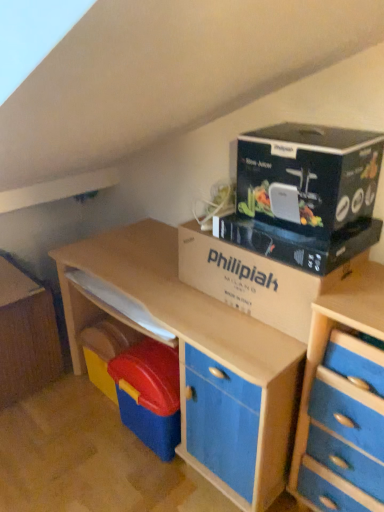
Question: Is black cardboard at upper right looking in the opposite direction of blue matte file cabinet at lower left?

Choices:
 (A) no
 (B) yes

Answer: (A)

Question: Is black cardboard at upper right surrounding blue matte file cabinet at lower left?

Choices:
 (A) no
 (B) yes

Answer: (A)

Question: Is black cardboard at upper right to the right of blue matte file cabinet at lower left from the viewer's perspective?

Choices:
 (A) no
 (B) yes

Answer: (B)

Question: Does black cardboard at upper right have a smaller size compared to blue matte file cabinet at lower left?

Choices:
 (A) yes
 (B) no

Answer: (A)

Question: From a real-world perspective, does black cardboard at upper right sit lower than blue matte file cabinet at lower left?

Choices:
 (A) yes
 (B) no

Answer: (B)

Question: Does point (359, 508) appear closer or farther from the camera than point (29, 332)?

Choices:
 (A) closer
 (B) farther

Answer: (A)

Question: From their relative heights in the image, would you say blue wood chest of drawers at right is taller or shorter than blue matte file cabinet at lower left?

Choices:
 (A) short
 (B) tall

Answer: (B)

Question: From the image's perspective, is blue wood chest of drawers at right above or below blue matte file cabinet at lower left?

Choices:
 (A) below
 (B) above

Answer: (A)

Question: Do you think blue wood chest of drawers at right is within blue matte file cabinet at lower left, or outside of it?

Choices:
 (A) inside
 (B) outside

Answer: (B)

Question: From the image's perspective, is blue matte file cabinet at lower left above or below cardboard box at center?

Choices:
 (A) below
 (B) above

Answer: (A)

Question: Relative to cardboard box at center, is blue matte file cabinet at lower left in front or behind?

Choices:
 (A) front
 (B) behind

Answer: (B)

Question: Considering the relative positions of blue matte file cabinet at lower left and cardboard box at center in the image provided, is blue matte file cabinet at lower left to the left or to the right of cardboard box at center?

Choices:
 (A) left
 (B) right

Answer: (A)

Question: Is blue matte file cabinet at lower left taller or shorter than cardboard box at center?

Choices:
 (A) tall
 (B) short

Answer: (A)

Question: Is blue wood chest of drawers at right wider or thinner than cardboard box at center?

Choices:
 (A) wide
 (B) thin

Answer: (A)

Question: From a real-world perspective, is blue wood chest of drawers at right physically located above or below cardboard box at center?

Choices:
 (A) above
 (B) below

Answer: (B)